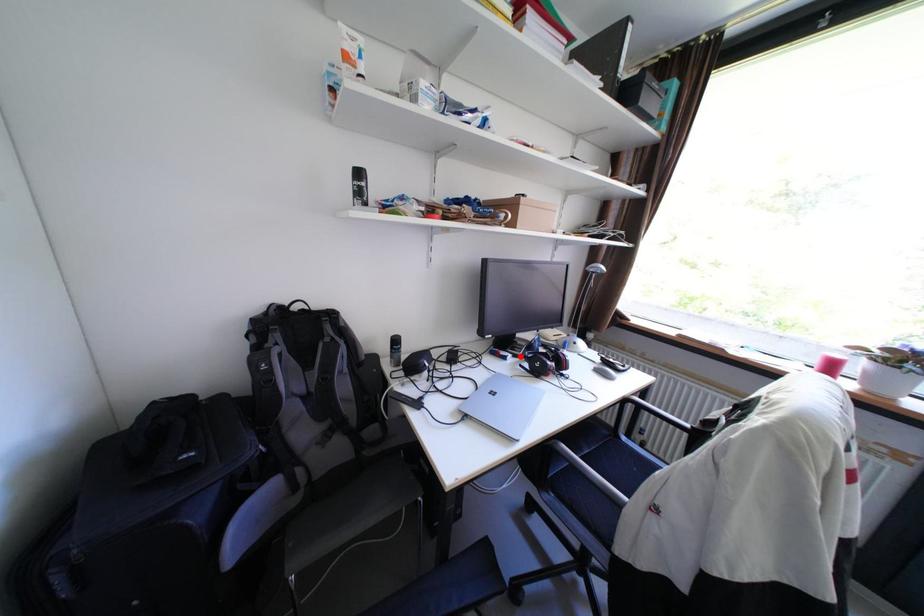
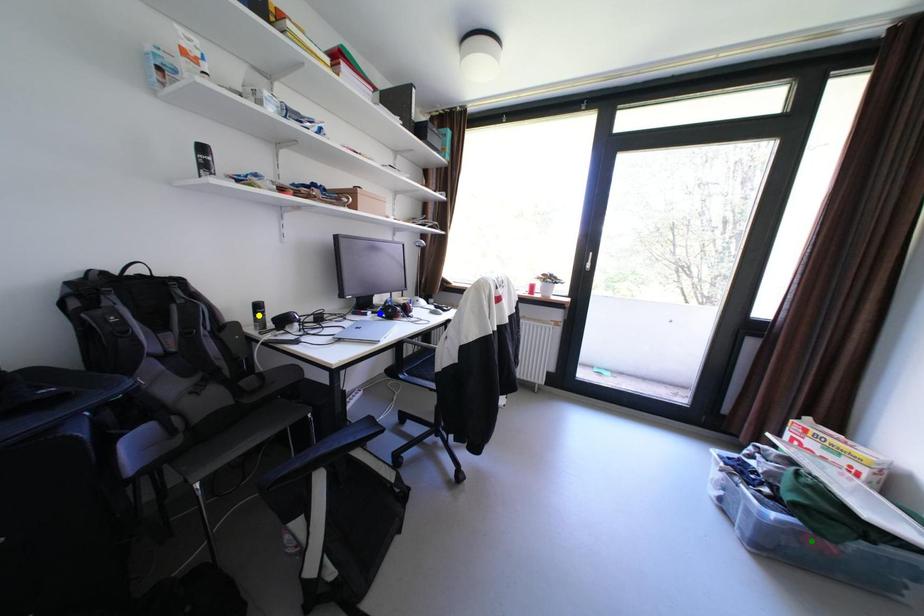
Question: I am providing you with two images of the same scene from different viewpoints. A red point is marked on the first image. You are given multiple points on the second image. Can you choose the point in image 2 that corresponds to the point in image 1?

Choices:
 (A) green point
 (B) yellow point
 (C) blue point

Answer: (C)